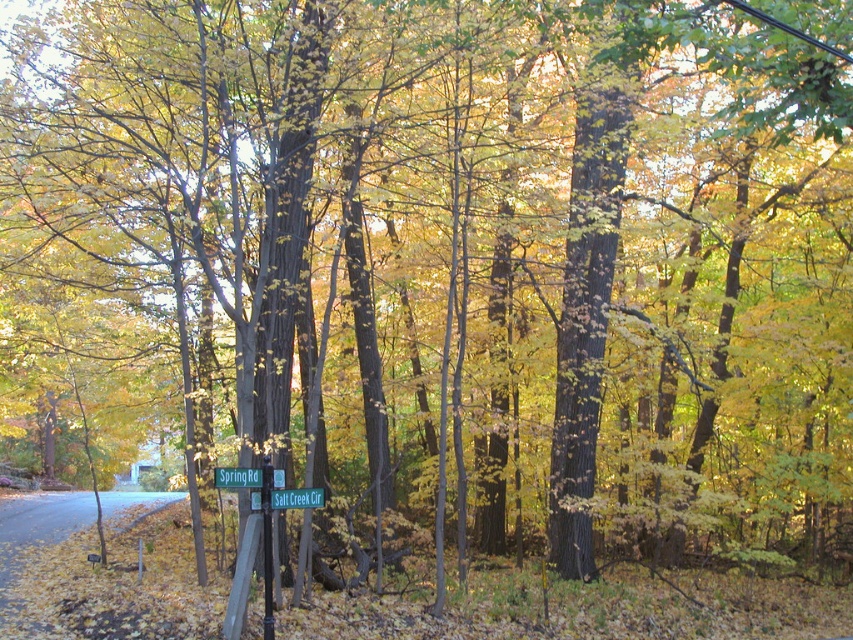
You are a delivery driver who needs to ensure that your vehicle can pass through the intersection of Spring Rd and Salt Creek Cir. The signpost and street sign are in the center of the road. Which object, the metallic signpost at center or the green plastic street sign at center, has a narrower width that might pose a clearance issue for your vehicle?

The metallic signpost at center has a lesser width compared to the green plastic street sign at center, so the metallic signpost at center is narrower and less likely to pose a clearance issue. The green plastic street sign at center is wider, so it might be the one to check for clearance.

You are a delivery driver who needs to read both the green plastic street sign at center and the green plastic sign at center mounted on the pole at the intersection of Spring Rd and Salt Creek Cir. Your vehicle has a 12 inch wide side mirror that you want to extend towards the pole. Can the mirror fit between the two signs without touching them?

The green plastic street sign at center and green plastic sign at center are 14.34 inches apart. Since the mirror is 12 inches wide, there is enough space between the two signs for the mirror to fit without touching them.

You are standing at the intersection of Spring Rd and Salt Creek Cir. You see a point at coordinates (x=267, y=547). What object is located at that point?

The point at coordinates (x=267, y=547) corresponds to the metallic signpost at center.